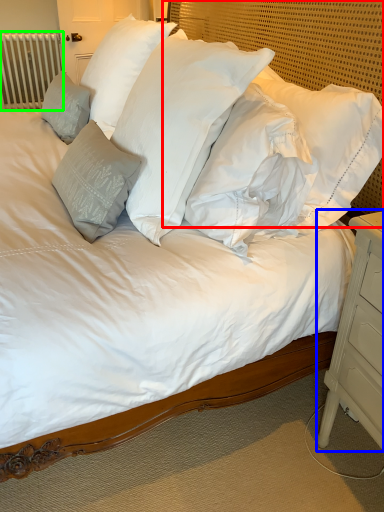
Question: Considering the real-world distances, which object is closest to headboard (highlighted by a red box)? nightstand (highlighted by a blue box) or radiator (highlighted by a green box).

Choices:
 (A) nightstand
 (B) radiator

Answer: (A)